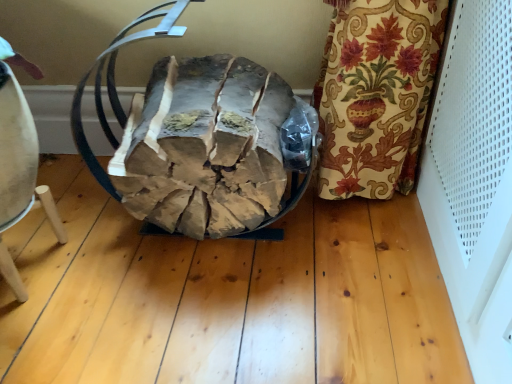
Question: Considering the relative sizes of brown leather bean bag chair at center and light brown wooden stool at lower left in the image provided, is brown leather bean bag chair at center shorter than light brown wooden stool at lower left?

Choices:
 (A) no
 (B) yes

Answer: (A)

Question: Can you confirm if brown leather bean bag chair at center is positioned to the right of light brown wooden stool at lower left?

Choices:
 (A) no
 (B) yes

Answer: (B)

Question: Is light brown wooden stool at lower left surrounded by brown leather bean bag chair at center?

Choices:
 (A) yes
 (B) no

Answer: (B)

Question: Considering the relative sizes of brown leather bean bag chair at center and light brown wooden stool at lower left in the image provided, is brown leather bean bag chair at center wider than light brown wooden stool at lower left?

Choices:
 (A) yes
 (B) no

Answer: (A)

Question: From a real-world perspective, does brown leather bean bag chair at center stand above light brown wooden stool at lower left?

Choices:
 (A) no
 (B) yes

Answer: (B)

Question: Is brown leather bean bag chair at center taller than light brown wooden stool at lower left?

Choices:
 (A) no
 (B) yes

Answer: (B)

Question: Is light brown wooden stool at lower left far away from brown leather bean bag chair at center?

Choices:
 (A) no
 (B) yes

Answer: (A)

Question: Is the position of light brown wooden stool at lower left more distant than that of brown leather bean bag chair at center?

Choices:
 (A) yes
 (B) no

Answer: (A)

Question: Is light brown wooden stool at lower left completely or partially outside of brown leather bean bag chair at center?

Choices:
 (A) no
 (B) yes

Answer: (B)

Question: Can you confirm if light brown wooden stool at lower left is taller than brown leather bean bag chair at center?

Choices:
 (A) yes
 (B) no

Answer: (B)

Question: From a real-world perspective, is light brown wooden stool at lower left located higher than brown leather bean bag chair at center?

Choices:
 (A) no
 (B) yes

Answer: (A)

Question: Can you confirm if light brown wooden stool at lower left is bigger than brown leather bean bag chair at center?

Choices:
 (A) no
 (B) yes

Answer: (A)

Question: From the image's perspective, is light brown wooden stool at lower left above or below brown leather bean bag chair at center?

Choices:
 (A) below
 (B) above

Answer: (A)